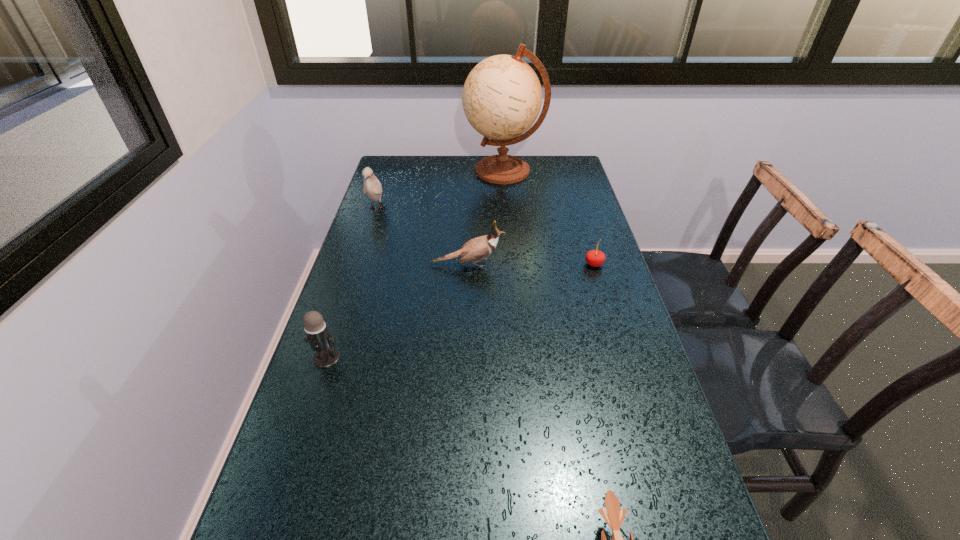
Where is `bird that stands as the second closest to the farthest bird`? bird that stands as the second closest to the farthest bird is located at coordinates (614, 518).

At what (x,y) coordinates should I click in order to perform the action: click on bird that is the second closest to the farthest bird. Please return your answer as a coordinate pair (x, y). The image size is (960, 540). Looking at the image, I should click on (614, 518).

You are a GUI agent. You are given a task and a screenshot of the screen. Output one action in this format:
    pyautogui.click(x=<x>, y=<y>)
    Task: Click on the free location that satisfies the following two spatial constraints: 1. on the front side of the cherry; 2. at the face of the second bird from right to left
    
    Given the screenshot: What is the action you would take?
    pyautogui.click(x=594, y=265)

What are the coordinates of `free location that satisfies the following two spatial constraints: 1. on the surface of the farthest object; 2. on the right side of the cherry` in the screenshot? It's located at (512, 264).